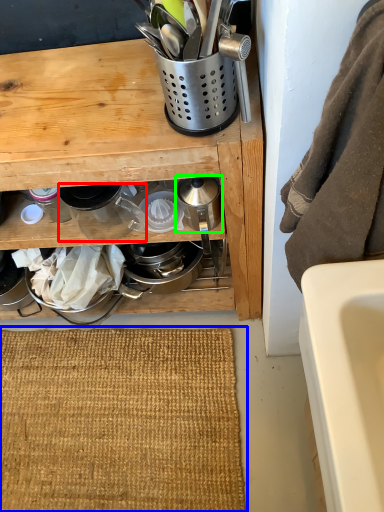
Question: Which object is the closest to the appliance (highlighted by a red box)? Choose among these: doormat (highlighted by a blue box) or appliance (highlighted by a green box).

Choices:
 (A) doormat
 (B) appliance

Answer: (B)